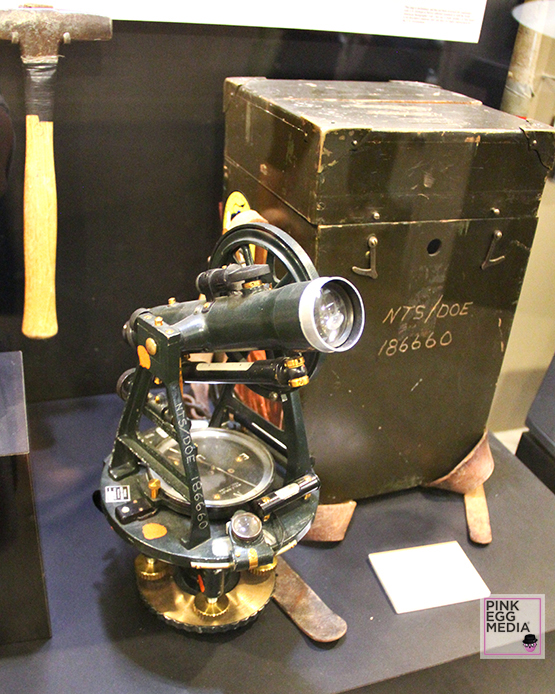
You are a GUI agent. You are given a task and a screenshot of the screen. Output one action in this format:
    pyautogui.click(x=<x>, y=<y>)
    Task: Click on the stand
    
    Given the screenshot: What is the action you would take?
    pyautogui.click(x=183, y=402)